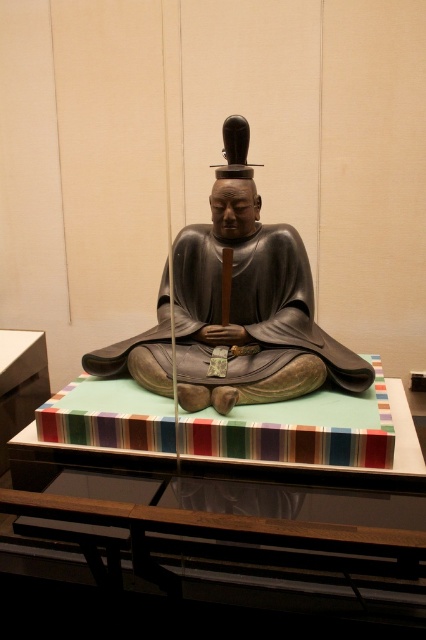
Does green felt table at center lie behind matte gray statue at center?

No, it is not.

Which is more to the left, green felt table at center or matte gray statue at center?

Positioned to the left is matte gray statue at center.

Identify the location of green felt table at center. The width and height of the screenshot is (426, 640). (201, 589).